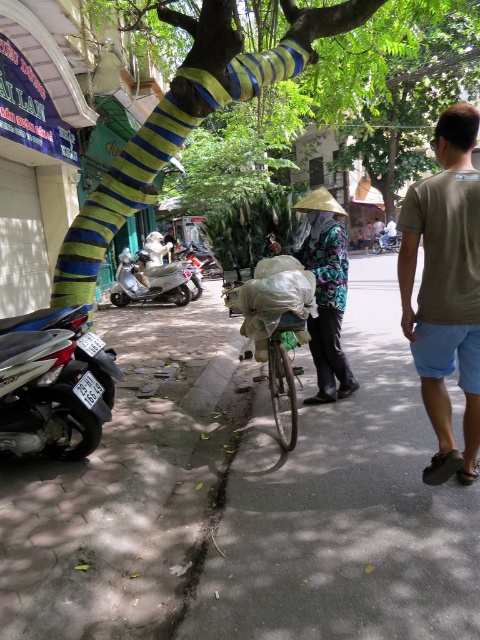
Question: Is paved concrete sidewalk at lower left wider than floral fabric hat at center?

Choices:
 (A) yes
 (B) no

Answer: (B)

Question: Can you confirm if green matte bicycle at center is positioned below metallic silver motorcycle at center?

Choices:
 (A) yes
 (B) no

Answer: (A)

Question: Which object is closer to the camera taking this photo?

Choices:
 (A) silver metallic scooter at center-left
 (B) green matte bicycle at center

Answer: (B)

Question: Can you confirm if silver metallic motorcycle at lower left is bigger than brown cotton shirt at right?

Choices:
 (A) no
 (B) yes

Answer: (A)

Question: Which object is positioned closest to the green matte bicycle at center?

Choices:
 (A) metallic silver motorcycle at center
 (B) silver metallic motorcycle at lower left

Answer: (B)

Question: Which point is farther to the camera?

Choices:
 (A) [324, 291]
 (B) [386, 246]
 (C) [266, 337]

Answer: (B)